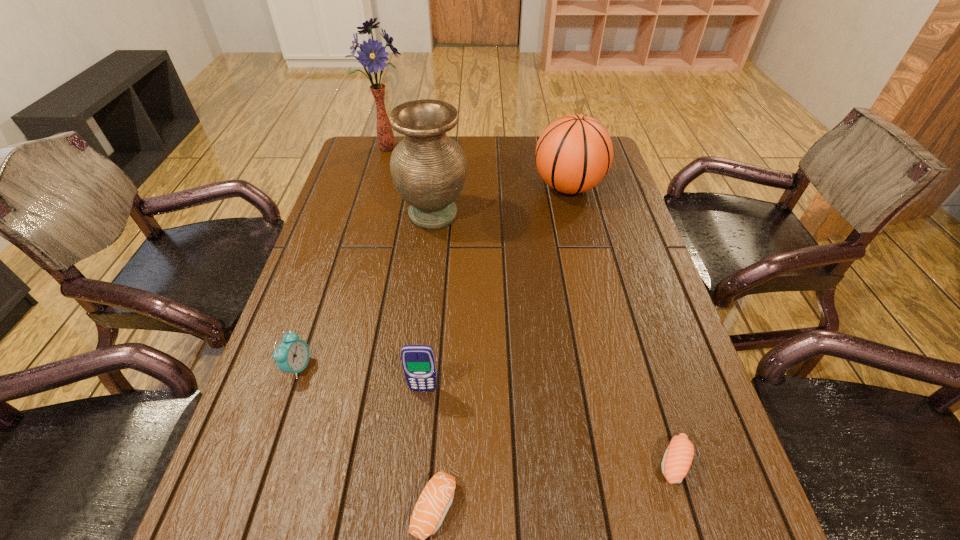
Where is `sushi that is at the right edge`? Image resolution: width=960 pixels, height=540 pixels. sushi that is at the right edge is located at coordinates (678, 457).

In order to click on object that is at the far left corner in this screenshot , I will do `click(372, 55)`.

This screenshot has width=960, height=540. I want to click on object that is at the far right corner, so (574, 153).

This screenshot has width=960, height=540. In order to click on free region at the far edge in this screenshot , I will do `click(461, 136)`.

Locate an element on the screen. free space at the left edge is located at coordinates (344, 338).

Identify the location of vacant space at the right edge of the desktop. Image resolution: width=960 pixels, height=540 pixels. (679, 509).

Locate an element on the screen. This screenshot has height=540, width=960. vacant space at the near right corner of the desktop is located at coordinates (664, 536).

You are a GUI agent. You are given a task and a screenshot of the screen. Output one action in this format:
    pyautogui.click(x=<x>, y=<y>)
    Task: Click on the free space between the second tallest object and the fifth shortest object
    This screenshot has height=540, width=960.
    Given the screenshot: What is the action you would take?
    pyautogui.click(x=501, y=201)

Where is `blank region between the right sushi and the basketball`? blank region between the right sushi and the basketball is located at coordinates (621, 325).

Find the location of a particular element. The image size is (960, 540). free space between the flower arrangement and the cellular telephone is located at coordinates (405, 269).